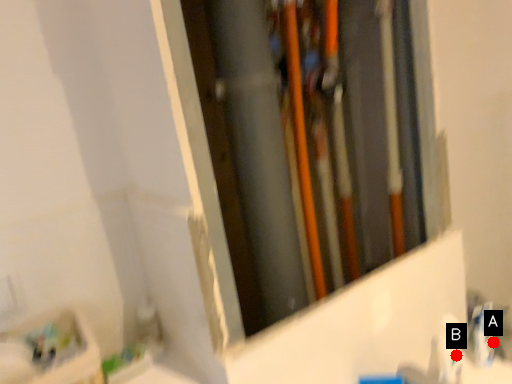
Question: Two points are circled on the image, labeled by A and B beside each circle. Which of the following is the farthest from the observer?

Choices:
 (A) A is further
 (B) B is further

Answer: (A)